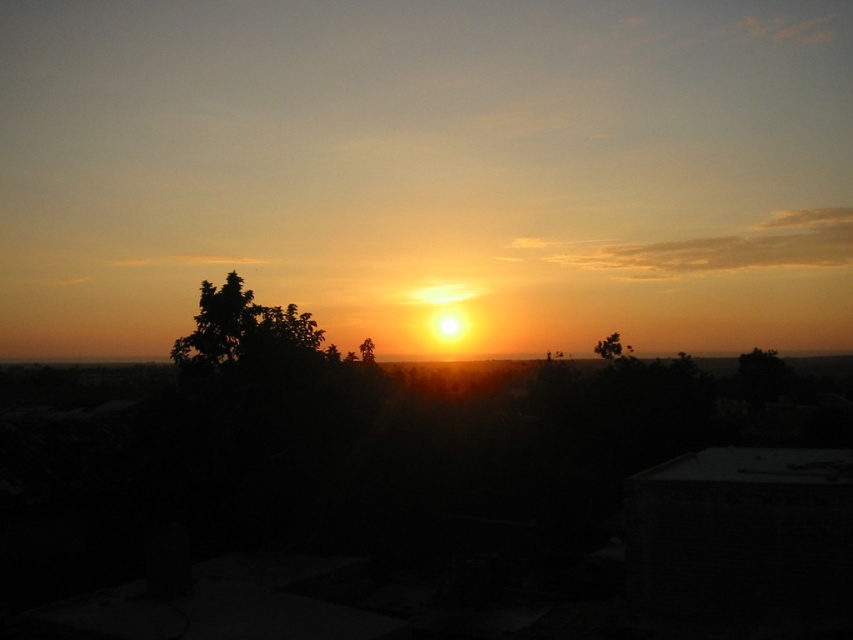
You are an artist trying to paint the sunset scene. You want to place the green leafy tree at upper right and the green leafy tree at center in your painting. According to the scene, which tree should be positioned to the right side of the other?

The green leafy tree at upper right is to the right of the green leafy tree at center, so the green leafy tree at upper right should be positioned to the right side of the green leafy tree at center in the painting.